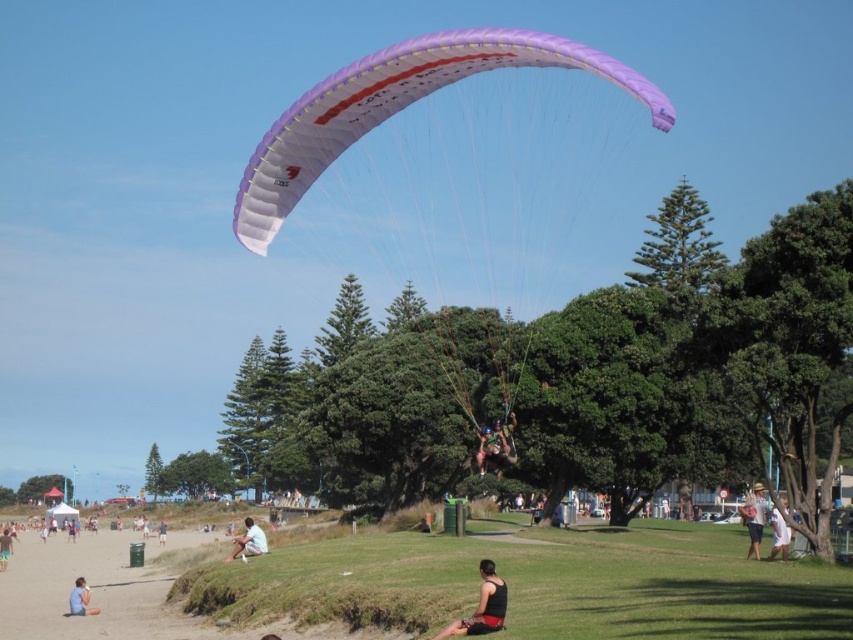
Question: Does white cotton shirt at lower center have a greater width compared to white cotton shirt at lower right?

Choices:
 (A) no
 (B) yes

Answer: (B)

Question: Which point is farther from the camera taking this photo?

Choices:
 (A) (781, 540)
 (B) (509, 465)

Answer: (B)

Question: Estimate the real-world distances between objects in this image. Which object is farther from the blue fabric shirt at lower left?

Choices:
 (A) light blue shorts at lower left
 (B) matte purple parachute at center

Answer: (A)

Question: Does matte purple parachute at center have a greater width compared to light brown fabric hat at lower right?

Choices:
 (A) yes
 (B) no

Answer: (B)

Question: Considering the relative positions of purple matte parachute at upper center and light blue fabric shorts at lower center in the image provided, where is purple matte parachute at upper center located with respect to light blue fabric shorts at lower center?

Choices:
 (A) below
 (B) above

Answer: (B)

Question: Which point is farther to the camera?

Choices:
 (A) (160, 528)
 (B) (3, 570)
 (C) (776, 508)
 (D) (489, 570)

Answer: (A)